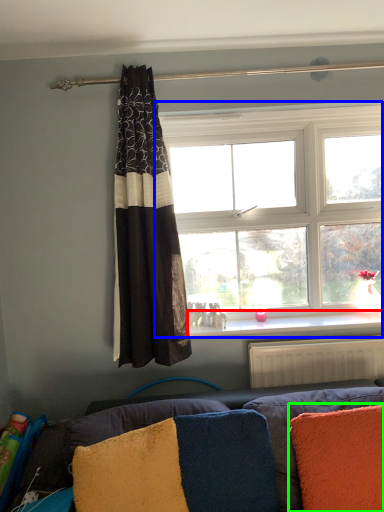
Question: Estimate the real-world distances between objects in this image. Which object is farther from window sill (highlighted by a red box), window (highlighted by a blue box) or pillow (highlighted by a green box)?

Choices:
 (A) window
 (B) pillow

Answer: (B)